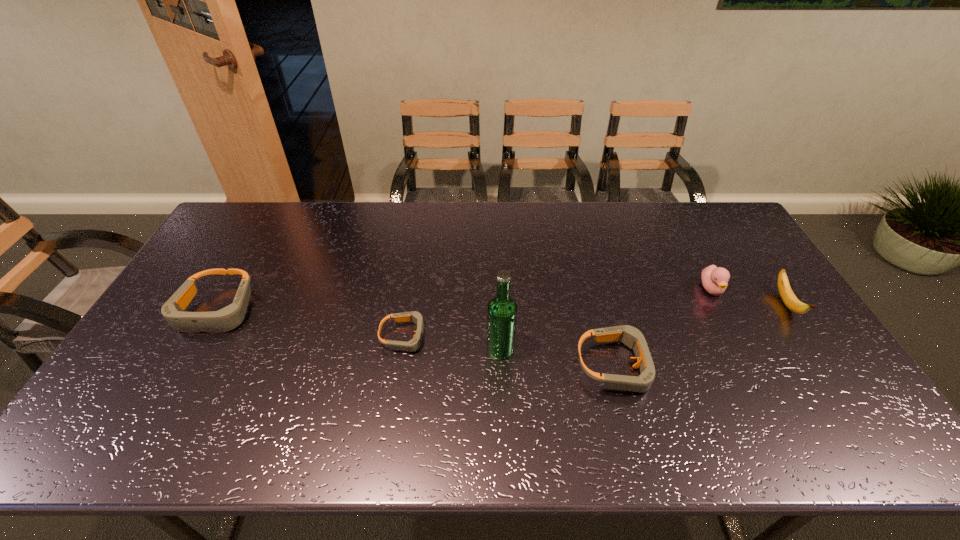
Find the location of a particular element. The image size is (960, 540). vacant space at the left edge of the desktop is located at coordinates (222, 306).

Image resolution: width=960 pixels, height=540 pixels. Find the location of `vacant space at the right edge of the desktop`. vacant space at the right edge of the desktop is located at coordinates (768, 331).

In the image, there is a desktop. Where is `free space at the far left corner`? free space at the far left corner is located at coordinates (247, 211).

Find the location of `free space at the near left corner of the desktop`. free space at the near left corner of the desktop is located at coordinates (143, 410).

You are a GUI agent. You are given a task and a screenshot of the screen. Output one action in this format:
    pyautogui.click(x=<x>, y=<y>)
    Task: Click on the free space between the second shortest object and the rightmost object
    This screenshot has width=960, height=540.
    Given the screenshot: What is the action you would take?
    (701, 335)

Image resolution: width=960 pixels, height=540 pixels. In order to click on vacant space that's between the second goggles from right to left and the banana in this screenshot , I will do (x=595, y=320).

The image size is (960, 540). What are the coordinates of `vacant area that lies between the banana and the beer bottle` in the screenshot? It's located at click(643, 327).

This screenshot has width=960, height=540. I want to click on free space between the tallest object and the leftmost object, so click(358, 329).

The width and height of the screenshot is (960, 540). Identify the location of unoccupied position between the rightmost object and the fifth object from left to right. click(x=749, y=296).

Where is `vacant region between the second shortest object and the duckling`? vacant region between the second shortest object and the duckling is located at coordinates (664, 327).